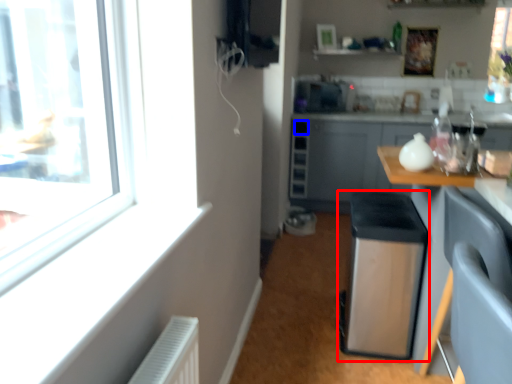
Question: Which object appears closest to the camera in this image, water heater (highlighted by a red box) or drawer (highlighted by a blue box)?

Choices:
 (A) water heater
 (B) drawer

Answer: (A)